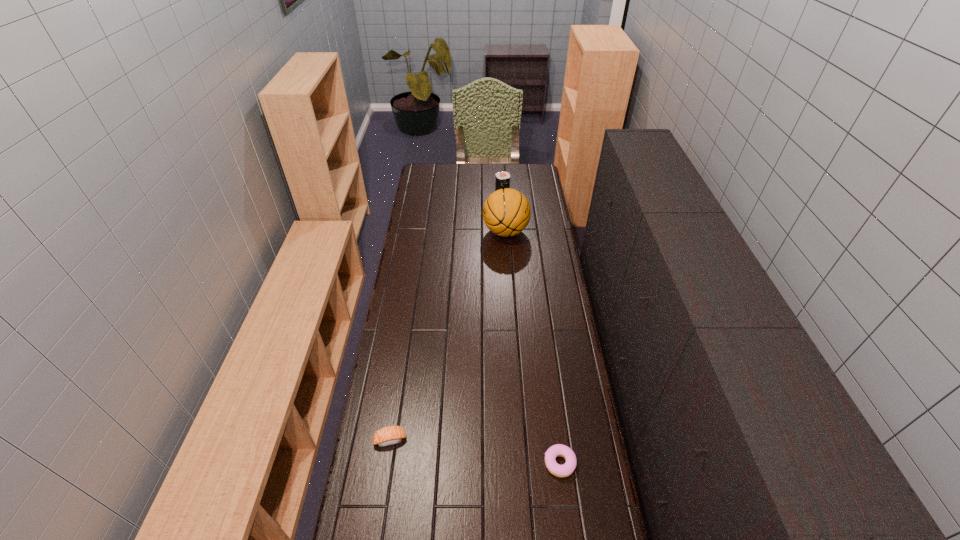
I want to click on vacant space located 0.290m on the surface of the third nearest object near the brand logo, so click(425, 232).

Where is `free location located on the right of the third shortest object`? This screenshot has height=540, width=960. free location located on the right of the third shortest object is located at coordinates (x=531, y=186).

You are a GUI agent. You are given a task and a screenshot of the screen. Output one action in this format:
    pyautogui.click(x=<x>, y=<y>)
    Task: Click on the vacant position located 0.240m on the front of the left sushi
    
    Given the screenshot: What is the action you would take?
    pyautogui.click(x=376, y=529)

Locate an element on the screen. vacant area located on the back of the nearest object is located at coordinates click(546, 355).

The image size is (960, 540). I want to click on object that is at the far edge, so click(x=502, y=178).

Find the location of a particular element. This screenshot has height=540, width=960. object at the left edge is located at coordinates [390, 435].

The image size is (960, 540). I want to click on basketball that is at the right edge, so coord(506,212).

Identify the location of doughnut present at the right edge. The height and width of the screenshot is (540, 960). (565, 470).

The width and height of the screenshot is (960, 540). In the image, there is a desktop. What are the coordinates of `blank space at the far edge` in the screenshot? It's located at (462, 174).

Find the location of a particular element. vacant area at the left edge of the desktop is located at coordinates (411, 281).